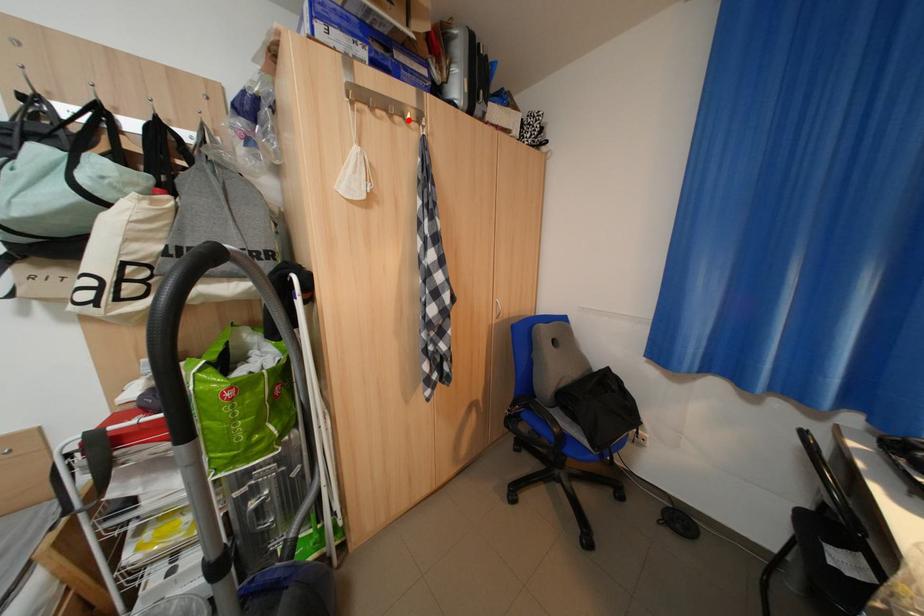
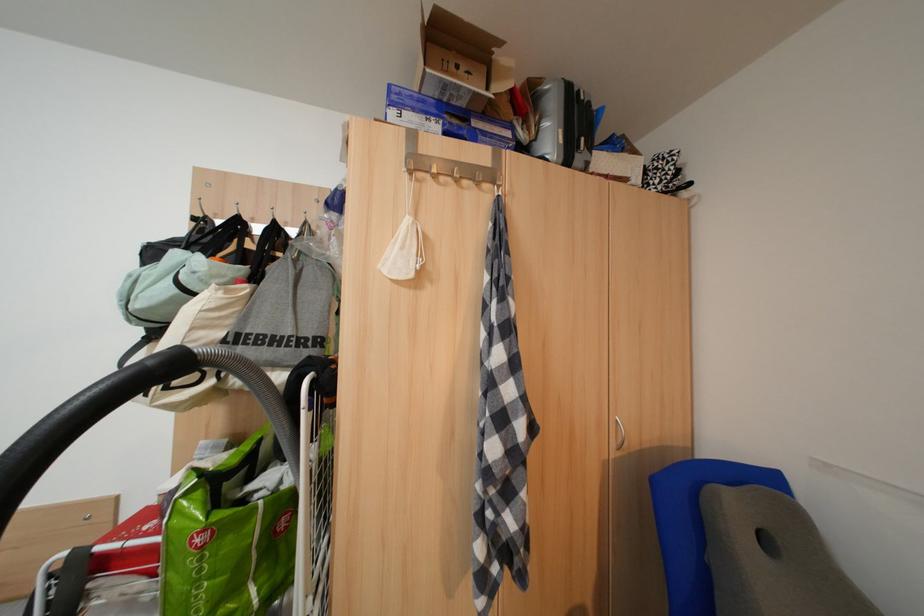
Find the pixel in the second image that matches the highlighted location in the first image.

(477, 184)